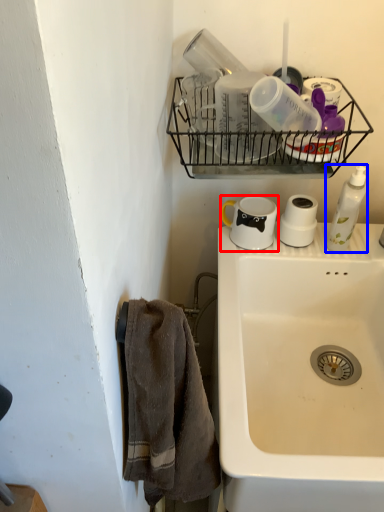
Question: Which object is closer to the camera taking this photo, coffee cup (highlighted by a red box) or soap dispenser (highlighted by a blue box)?

Choices:
 (A) coffee cup
 (B) soap dispenser

Answer: (B)